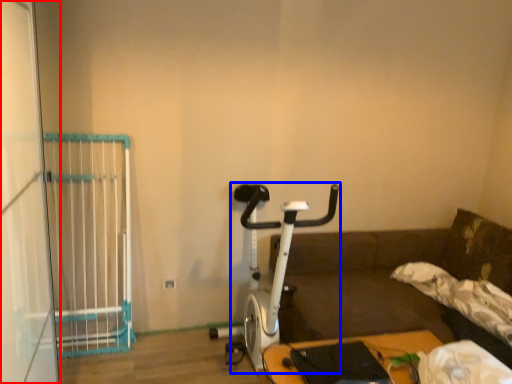
Question: Which of the following is the closest to the observer, screen door (highlighted by a red box) or stationary bicycle (highlighted by a blue box)?

Choices:
 (A) screen door
 (B) stationary bicycle

Answer: (A)